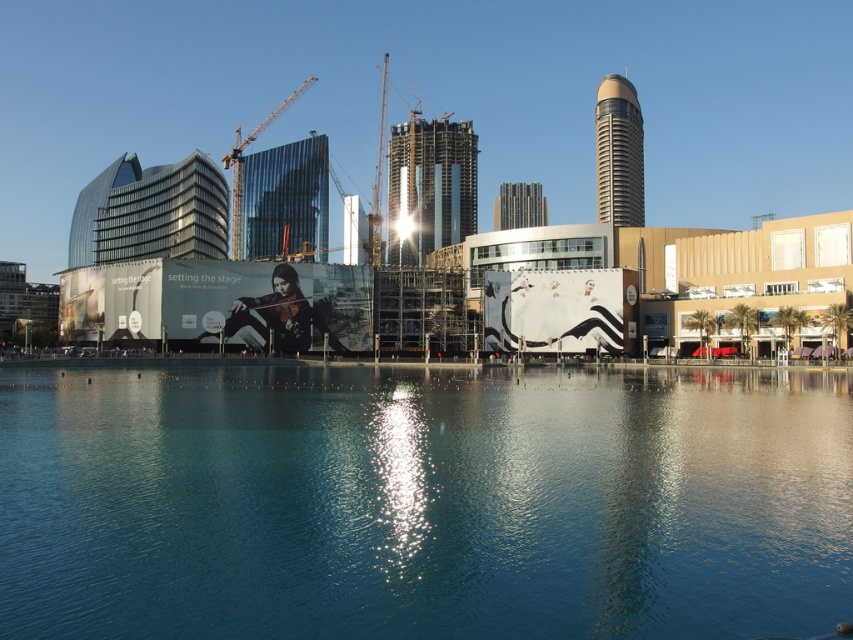
Can you confirm if clear blue water at center is shorter than metallic construction crane at center?

Yes.

Which is in front, point (529, 490) or point (239, 198)?

Point (529, 490) is more forward.

The height and width of the screenshot is (640, 853). What do you see at coordinates (424, 502) in the screenshot?
I see `clear blue water at center` at bounding box center [424, 502].

I want to click on clear blue water at center, so click(424, 502).